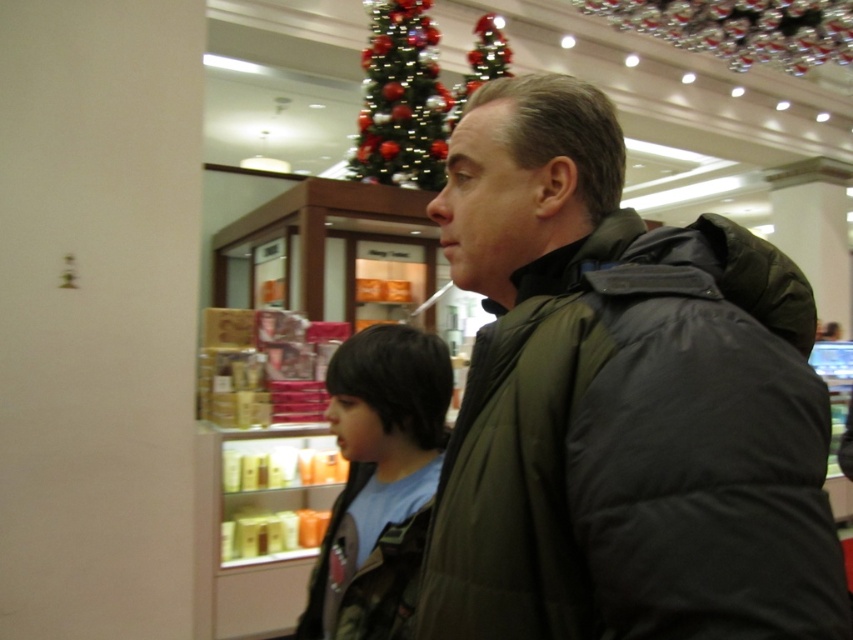
You are a store employee who needs to place a new decorative item that is 1.5 meters tall. You see the camouflage jacket at center and the shiny metallic tree at upper center. Which object can the new item be placed next to without blocking it?

The shiny metallic tree at upper center is taller than the camouflage jacket at center, so placing the 1.5 meters tall decorative item next to the camouflage jacket at center would prevent it from being blocked by the taller tree.

Looking at this image, you are a store employee who needs to place a new decoration that is 1 meter tall. You have two options for placement near the dark green puffer jacket at center and the shiny metallic tree at upper center. Based on their sizes, which object would you choose to place the decoration next to, and why?

The shiny metallic tree at upper center is larger than the dark green puffer jacket at center. Since the decoration is 1 meter tall, placing it next to the larger shiny metallic tree at upper center would provide better visibility and balance.

You are standing in a retail store and see two points marked in the scene. Which point, point (x=659, y=410) or point (x=395, y=97), is closer to you?

Point (x=659, y=410) is closer to the viewer than point (x=395, y=97).